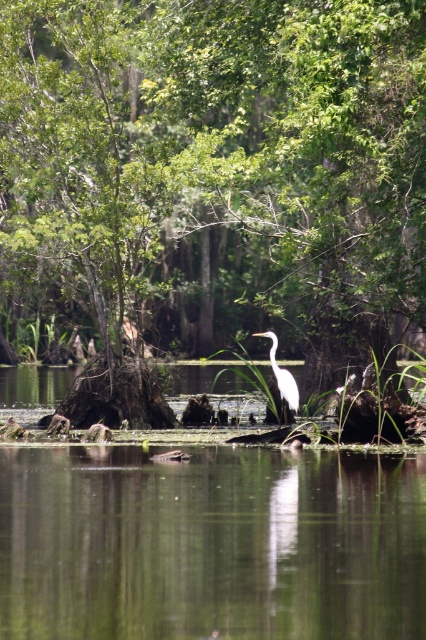
Is green leafy tree at center bigger than clear water at center?

Indeed, green leafy tree at center has a larger size compared to clear water at center.

Consider the image. Who is positioned more to the left, green leafy tree at center or clear water at center?

Positioned to the left is green leafy tree at center.

Find the location of a particular element. green leafy tree at center is located at coordinates (218, 172).

Find the location of `green leafy tree at center`. green leafy tree at center is located at coordinates (218, 172).

Which is in front, point (256, 173) or point (276, 372)?

Point (276, 372) is in front.

Who is more distant from viewer, [60,246] or [270,355]?

Positioned behind is point [60,246].

I want to click on green leafy tree at center, so click(218, 172).

Is clear water at center behind white smooth heron at center?

No.

Is clear water at center below white smooth heron at center?

Indeed, clear water at center is positioned under white smooth heron at center.

Which is behind, point (275, 628) or point (293, 394)?

The point (293, 394) is behind.

Identify the location of clear water at center. (210, 545).